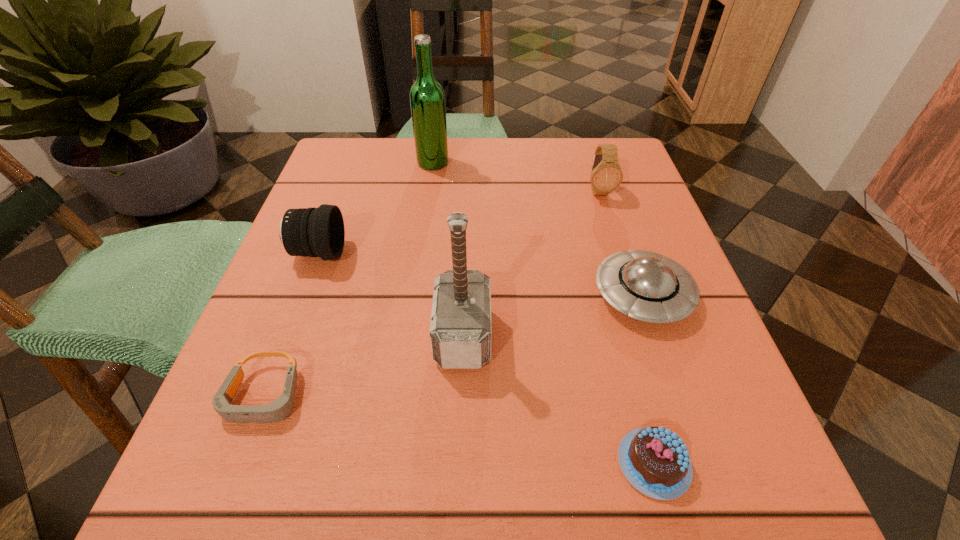
Locate an element on the screen. Image resolution: width=960 pixels, height=540 pixels. vacant space in between the shortest object and the sixth nearest object is located at coordinates coord(431,294).

Locate an element on the screen. object that is the closest to the chocolate cake is located at coordinates (649, 287).

Identify which object is the sixth nearest to the shortest object. Please provide its 2D coordinates. Your answer should be formatted as a tuple, i.e. [(x, y)], where the tuple contains the x and y coordinates of a point satisfying the conditions above.

[(606, 175)]

The height and width of the screenshot is (540, 960). I want to click on free location that satisfies the following two spatial constraints: 1. at the front element of the telephoto lens; 2. on the front and back of the shortest object, so click(x=265, y=396).

Find the location of a particular element. The image size is (960, 540). free space that satisfies the following two spatial constraints: 1. on the front side of the farthest object; 2. on the right side of the fifth tallest object is located at coordinates (415, 295).

Identify the location of vacant space that satisfies the following two spatial constraints: 1. at the front element of the sixth tallest object; 2. on the left side of the telephoto lens. This screenshot has height=540, width=960. (240, 463).

Find the location of a particular element. The width and height of the screenshot is (960, 540). vacant position in the image that satisfies the following two spatial constraints: 1. on the face of the sixth nearest object; 2. at the front element of the telephoto lens is located at coordinates (618, 253).